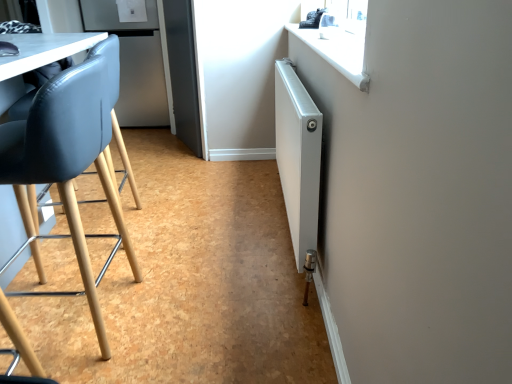
Question: Is matte black chair at left surrounding satin silver refrigerator at upper left?

Choices:
 (A) yes
 (B) no

Answer: (B)

Question: From a real-world perspective, is matte black chair at left over satin silver refrigerator at upper left?

Choices:
 (A) yes
 (B) no

Answer: (B)

Question: Is matte black chair at left to the right of satin silver refrigerator at upper left from the viewer's perspective?

Choices:
 (A) yes
 (B) no

Answer: (A)

Question: Is matte black chair at left shorter than satin silver refrigerator at upper left?

Choices:
 (A) no
 (B) yes

Answer: (B)

Question: Is matte black chair at left positioned with its back to satin silver refrigerator at upper left?

Choices:
 (A) yes
 (B) no

Answer: (B)

Question: Is matte black chair at left directly adjacent to satin silver refrigerator at upper left?

Choices:
 (A) yes
 (B) no

Answer: (B)

Question: From the image's perspective, would you say satin silver refrigerator at upper left is positioned over matte black chair at left?

Choices:
 (A) no
 (B) yes

Answer: (B)

Question: From the image's perspective, is satin silver refrigerator at upper left beneath matte black chair at left?

Choices:
 (A) yes
 (B) no

Answer: (B)

Question: From a real-world perspective, is satin silver refrigerator at upper left positioned under matte black chair at left based on gravity?

Choices:
 (A) no
 (B) yes

Answer: (A)

Question: Does satin silver refrigerator at upper left appear on the left side of matte black chair at left?

Choices:
 (A) no
 (B) yes

Answer: (B)

Question: Is satin silver refrigerator at upper left further to the viewer compared to matte black chair at left?

Choices:
 (A) no
 (B) yes

Answer: (B)

Question: Can you confirm if satin silver refrigerator at upper left is wider than matte black chair at left?

Choices:
 (A) no
 (B) yes

Answer: (B)

Question: From the image's perspective, is white metallic radiator at right over matte black chair at left?

Choices:
 (A) no
 (B) yes

Answer: (B)